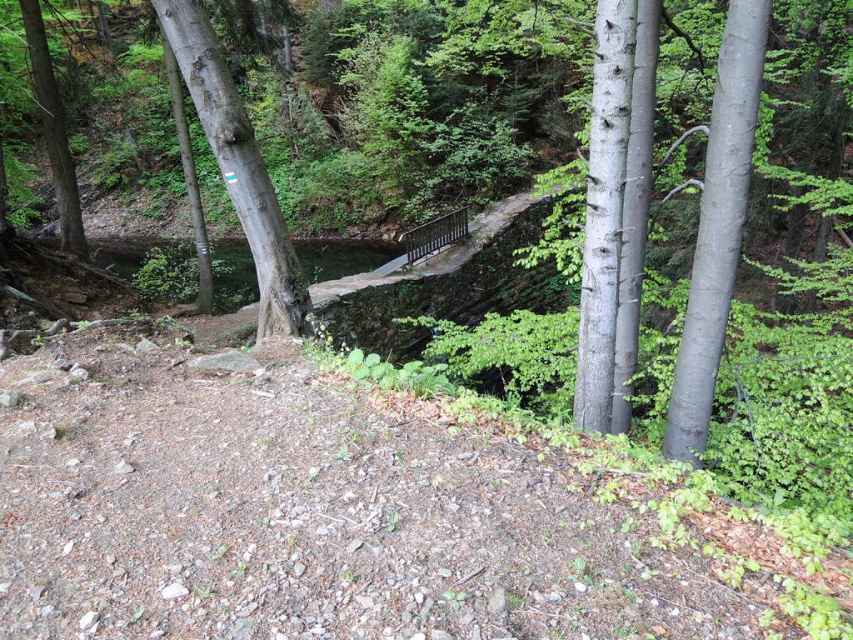
Can you confirm if smooth gray tree trunk at right is taller than green matte tree at left?

In fact, smooth gray tree trunk at right may be shorter than green matte tree at left.

Is smooth gray tree trunk at right smaller than green matte tree at left?

Correct, smooth gray tree trunk at right occupies less space than green matte tree at left.

Which is behind, point (699, 336) or point (61, 140)?

Point (61, 140)

This screenshot has width=853, height=640. Identify the location of smooth gray tree trunk at right. (717, 227).

Between smooth gray tree at right and smooth gray tree trunk at right, which one appears on the right side from the viewer's perspective?

smooth gray tree trunk at right is more to the right.

Is smooth gray tree at right positioned at the back of smooth gray tree trunk at right?

No, smooth gray tree at right is closer to the viewer.

Between point (635, 353) and point (720, 224), which one is positioned in front?

Positioned in front is point (720, 224).

Locate an element on the screen. smooth gray tree at right is located at coordinates (614, 216).

Who is lower down, smooth gray tree trunk at right or smooth gray bark tree at center?

Positioned lower is smooth gray tree trunk at right.

Find the location of a particular element. smooth gray tree trunk at right is located at coordinates (717, 227).